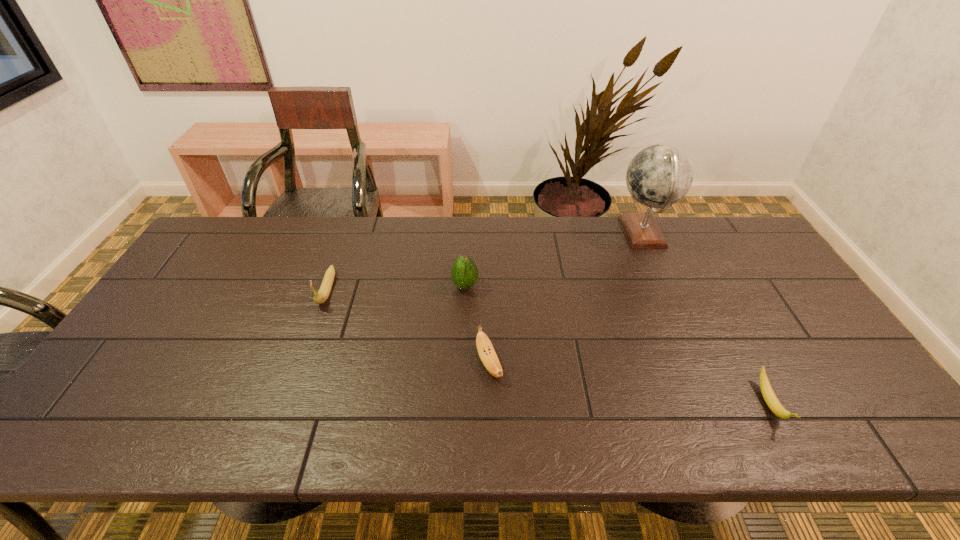
Image resolution: width=960 pixels, height=540 pixels. What are the coordinates of `free point between the tallest banana and the rightmost banana` in the screenshot? It's located at (548, 347).

I want to click on vacant area between the third tallest object and the rightmost object, so click(548, 347).

Where is `unoccupied area between the leftmost object and the second banana from right to left`? unoccupied area between the leftmost object and the second banana from right to left is located at coordinates (408, 327).

The width and height of the screenshot is (960, 540). I want to click on free point between the second banana from left to right and the leftmost banana, so click(408, 327).

This screenshot has height=540, width=960. I want to click on unoccupied area between the rightmost object and the avocado, so click(x=617, y=345).

At what (x,y) coordinates should I click in order to perform the action: click on vacant area that lies between the second banana from left to right and the tallest object. Please return your answer as a coordinate pair (x, y). Image resolution: width=960 pixels, height=540 pixels. Looking at the image, I should click on (565, 299).

Locate an element on the screen. free space between the avocado and the farthest banana is located at coordinates (396, 288).

Where is `vacant space that's between the avocado and the second banana from right to left`? This screenshot has width=960, height=540. vacant space that's between the avocado and the second banana from right to left is located at coordinates [477, 325].

Identify the location of free point between the rightmost object and the globe. This screenshot has width=960, height=540. click(707, 319).

Where is `unoccupied position between the avocado and the second object from right to left`? This screenshot has width=960, height=540. unoccupied position between the avocado and the second object from right to left is located at coordinates (554, 260).